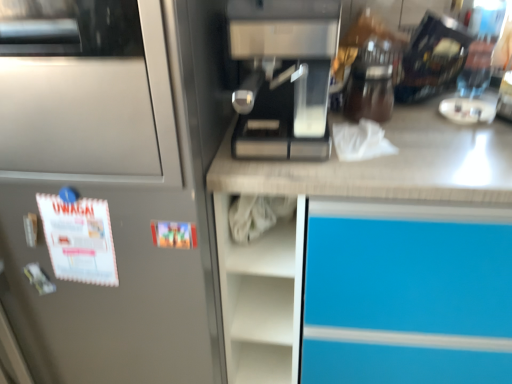
Question: Considering the relative positions of black glossy coffee maker at upper right and sleek metallic coffee machine at center in the image provided, is black glossy coffee maker at upper right to the left or to the right of sleek metallic coffee machine at center?

Choices:
 (A) right
 (B) left

Answer: (A)

Question: Is black glossy coffee maker at upper right wider or thinner than sleek metallic coffee machine at center?

Choices:
 (A) wide
 (B) thin

Answer: (B)

Question: Considering the real-world distances, which object is closest to the satin silver refrigerator at left?

Choices:
 (A) sleek metallic coffee machine at center
 (B) black glossy coffee maker at upper right

Answer: (A)

Question: Which object is positioned farthest from the black glossy coffee maker at upper right?

Choices:
 (A) satin silver refrigerator at left
 (B) sleek metallic coffee machine at center

Answer: (A)